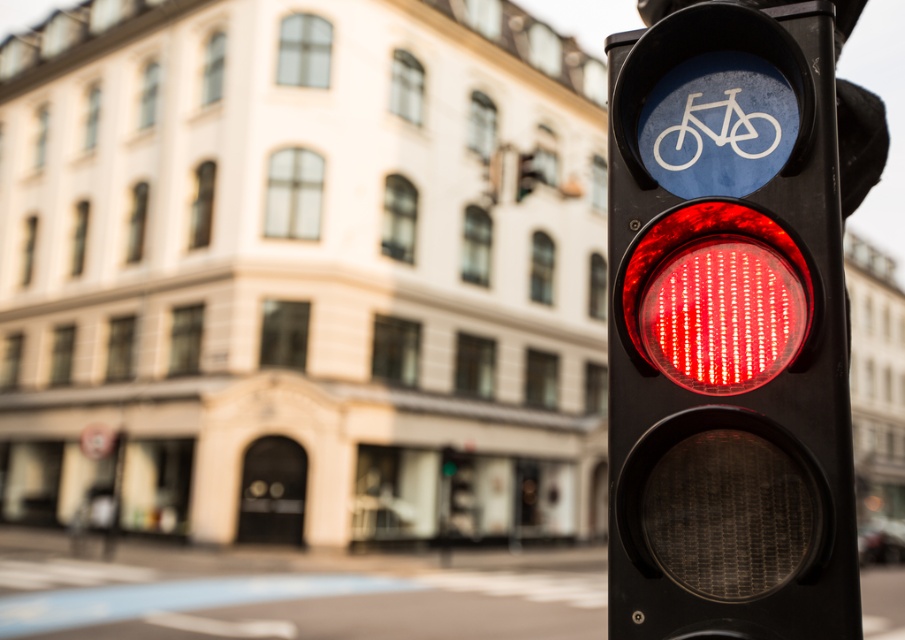
Question: Which point is closer to the camera taking this photo?

Choices:
 (A) (655, 147)
 (B) (624, 582)

Answer: (B)

Question: Which object appears closest to the camera in this image?

Choices:
 (A) matte black traffic light at right
 (B) white plastic bicycle at upper center

Answer: (A)

Question: Which of the following is the closest to the observer?

Choices:
 (A) matte black traffic light at right
 (B) white plastic bicycle at upper center

Answer: (A)

Question: Where is matte black traffic light at right located in relation to white plastic bicycle at upper center in the image?

Choices:
 (A) right
 (B) left

Answer: (B)

Question: Is matte black traffic light at right bigger than white plastic bicycle at upper center?

Choices:
 (A) no
 (B) yes

Answer: (B)

Question: Is matte black traffic light at right below white plastic bicycle at upper center?

Choices:
 (A) yes
 (B) no

Answer: (A)